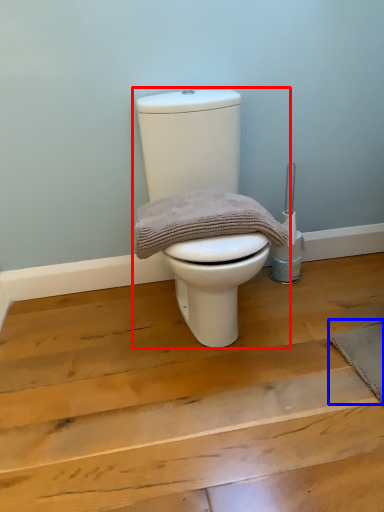
Question: Which of the following is the farthest to the observer, toilet (highlighted by a red box) or doormat (highlighted by a blue box)?

Choices:
 (A) toilet
 (B) doormat

Answer: (B)